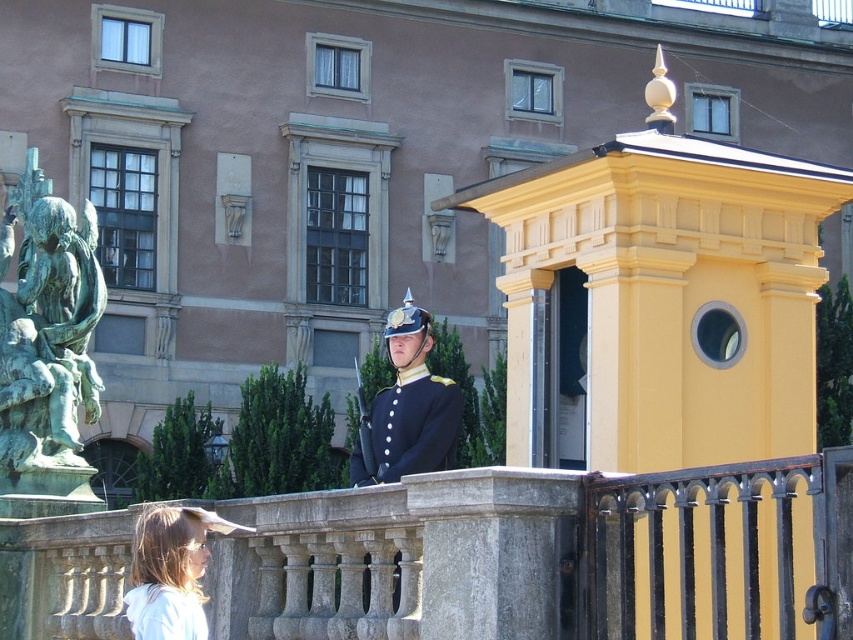
You are a visitor approaching the grand building and notice a stone balustrade at center and a navy blue fabric uniform at center. Which object is positioned to the right of the other?

The stone balustrade at center is to the right of the navy blue fabric uniform at center.